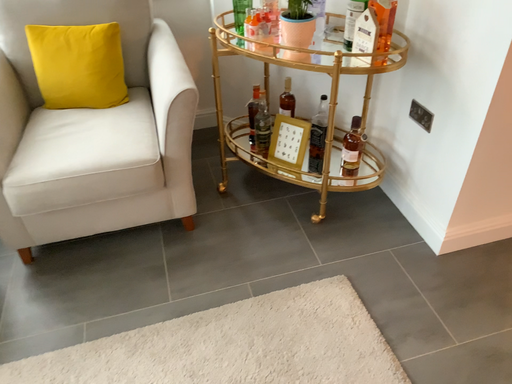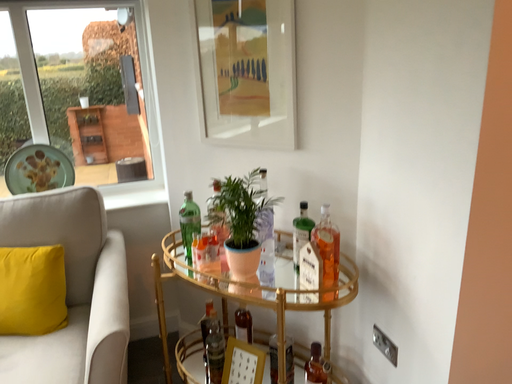
Question: How did the camera likely rotate when shooting the video?

Choices:
 (A) rotated downward
 (B) rotated upward

Answer: (B)